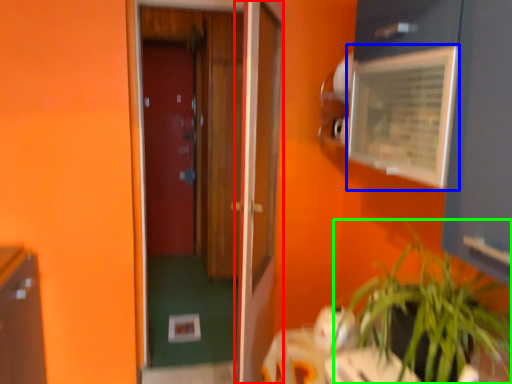
Question: Which object is positioned closest to door (highlighted by a red box)? Select from medicine cabinet (highlighted by a blue box) and houseplant (highlighted by a green box).

Choices:
 (A) medicine cabinet
 (B) houseplant

Answer: (A)